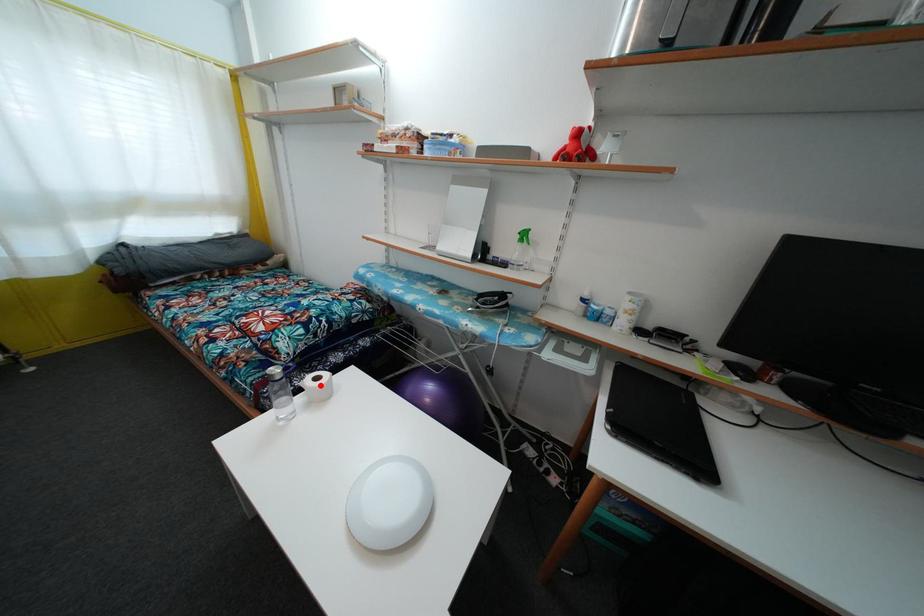
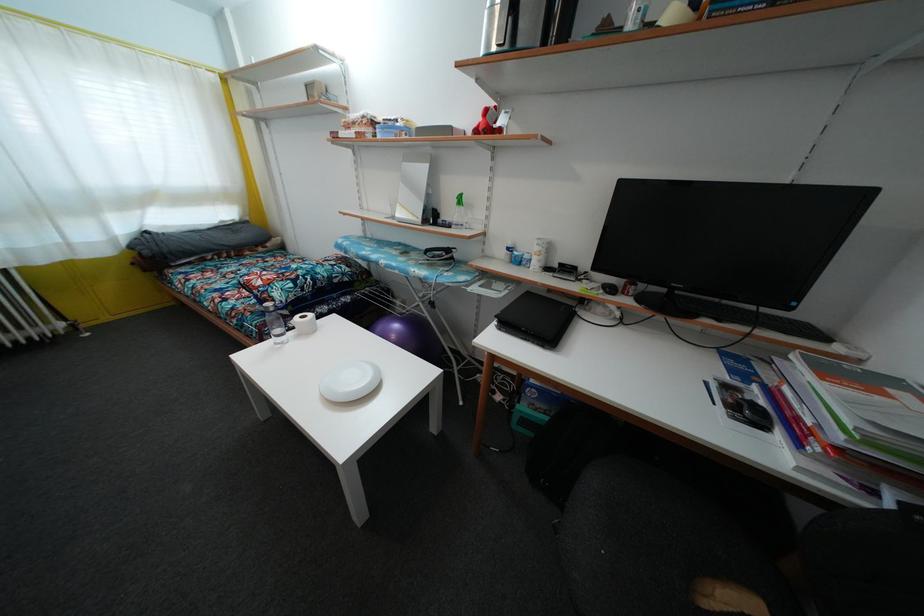
Where in the second image is the point corresponding to the highlighted location from the first image?

(307, 323)